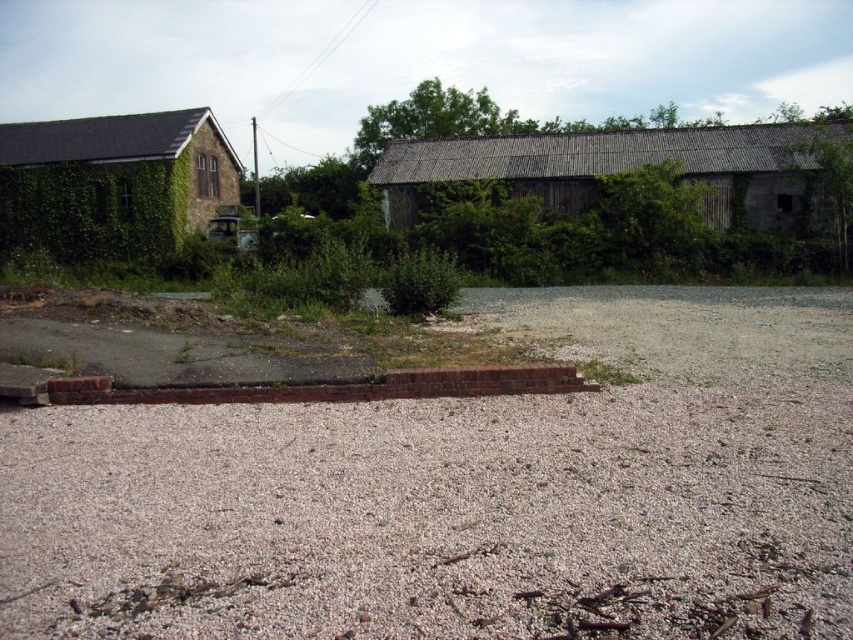
You are standing at the origin point of the coordinate system in this outdoor scene. You want to place a decorative rock exactly at the gray gravel at center. What are the coordinates where you should place the decorative rock?

The coordinates for the gray gravel at center are at point (x=425, y=513), so you should place the decorative rock there.

You are standing at the edge of the gravelly area and want to reach the green leafy bush at center. Which direction should you move relative to the gray gravel at center?

To reach the green leafy bush at center, you should move to the left of the gray gravel at center since the gray gravel at center is to the right of the green leafy bush at center.

You are standing at the edge of the gravelly area and need to walk to the green leafy bush at center. Which direction should you go from the gray gravel at center to reach the bush?

The green leafy bush at center is located at the same central position as the gray gravel, so you don not need to change direction. Just move forward from the gray gravel at center to reach the green leafy bush at center.